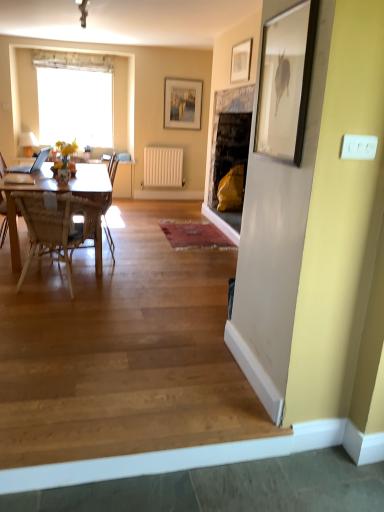
Question: Relative to matte glass vase at center, is white matte radiator at center in front or behind?

Choices:
 (A) behind
 (B) front

Answer: (A)

Question: Considering the positions of white matte radiator at center and matte glass vase at center in the image, is white matte radiator at center bigger or smaller than matte glass vase at center?

Choices:
 (A) big
 (B) small

Answer: (A)

Question: Considering the real-world distances, which object is farthest from the white matte radiator at center?

Choices:
 (A) matte gold picture frame at upper center, placed as the second picture frame when sorted from left to right
 (B) silver metallic picture frame at upper center, which is the 2th picture frame from right to left
 (C) wooden chair at left, which appears as the 1th chair when viewed from the back
 (D) wooden at lower left
 (E) matte glass vase at center

Answer: (D)

Question: Based on their relative distances, which object is nearer to the matte gold picture frame at upper center, arranged as the first picture frame when viewed from the right?

Choices:
 (A) silver metallic picture frame at upper center, which is the 1th picture frame from left to right
 (B) matte glass vase at center
 (C) white sheer curtain at upper left
 (D) woven wood chair at left, marked as the 1th chair in a front-to-back arrangement
 (E) wooden chair at left, which appears as the 1th chair when viewed from the back

Answer: (A)